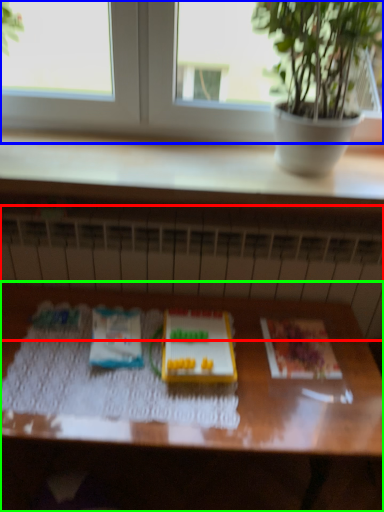
Question: Which is farther away from radiator (highlighted by a red box)? window (highlighted by a blue box) or table (highlighted by a green box)?

Choices:
 (A) window
 (B) table

Answer: (A)